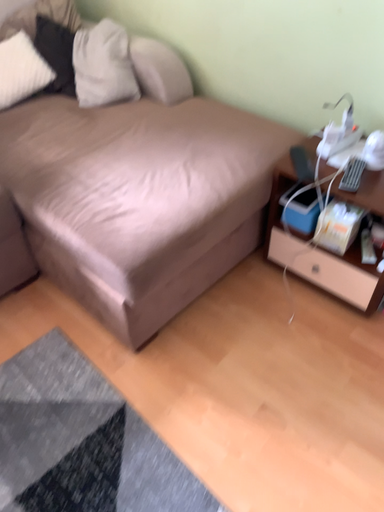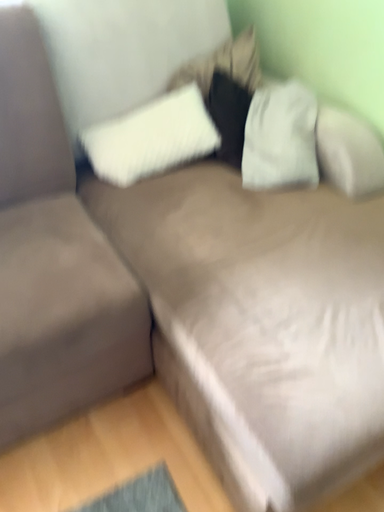
Question: How did the camera likely rotate when shooting the video?

Choices:
 (A) rotated right
 (B) rotated left

Answer: (B)